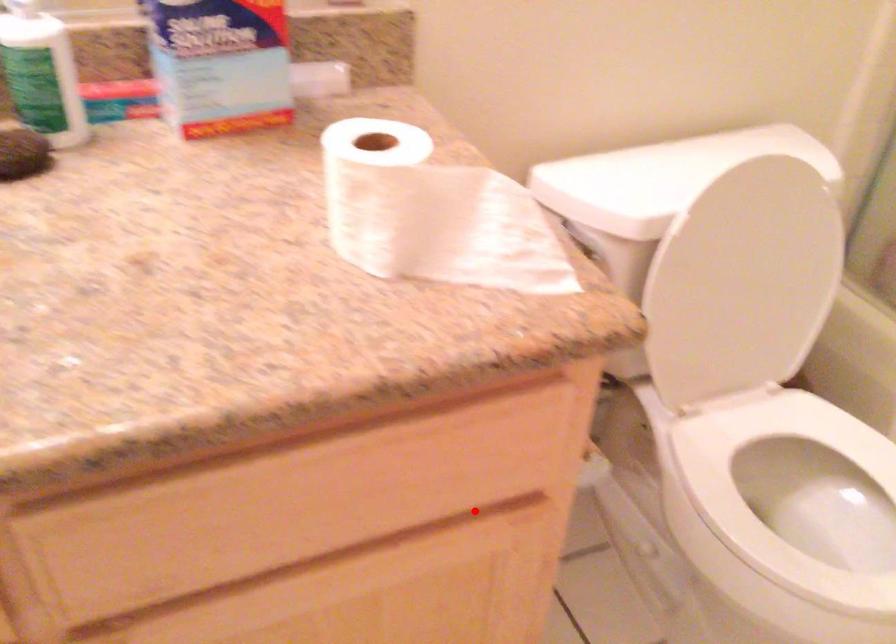
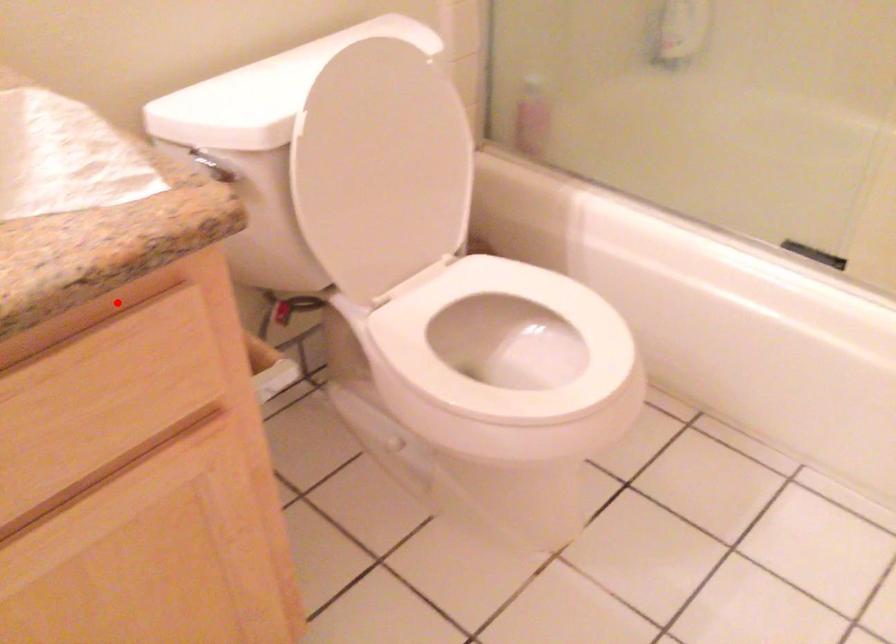
I am providing you with two images of the same scene from different viewpoints. A red point is marked on the first image and another point is marked on the second image. Do the highlighted points in image1 and image2 indicate the same real-world spot?

No